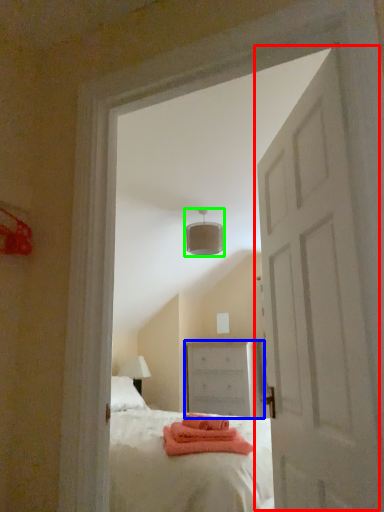
Question: Estimate the real-world distances between objects in this image. Which object is farther from door (highlighted by a red box), chest of drawers (highlighted by a blue box) or lamp (highlighted by a green box)?

Choices:
 (A) chest of drawers
 (B) lamp

Answer: (A)